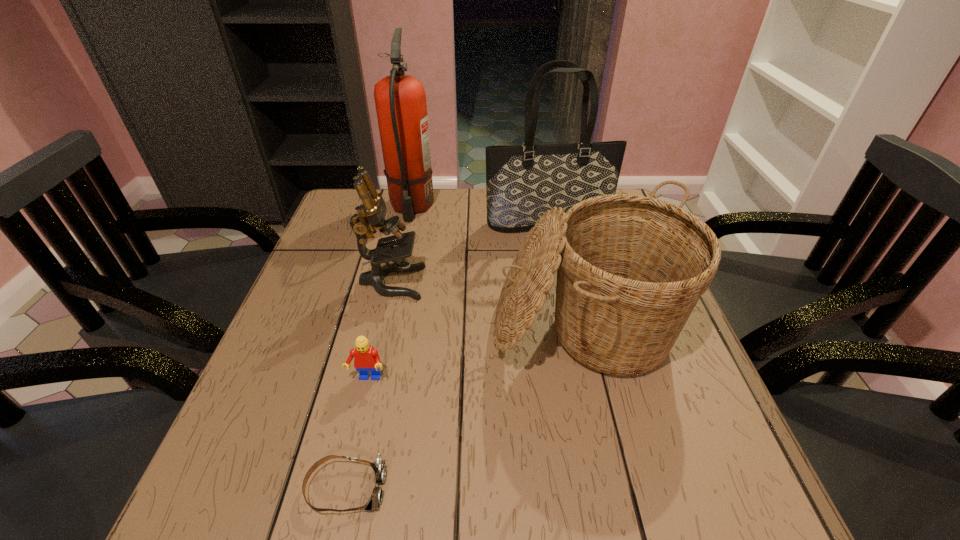
Where is `vacant space in between the fifth tallest object and the basket`? vacant space in between the fifth tallest object and the basket is located at coordinates (476, 356).

Where is `empty location between the shortest object and the microscope`? The height and width of the screenshot is (540, 960). empty location between the shortest object and the microscope is located at coordinates (369, 385).

Locate which object ranks second in proximity to the tote bag. Please provide its 2D coordinates. Your answer should be formatted as a tuple, i.e. [(x, y)], where the tuple contains the x and y coordinates of a point satisfying the conditions above.

[(630, 269)]

The image size is (960, 540). In order to click on the second closest object to the fifth tallest object in this screenshot , I will do `click(371, 214)`.

Find the location of a particular element. free location that satisfies the following two spatial constraints: 1. at the eyepieces of the microscope; 2. on the left side of the basket is located at coordinates (380, 334).

Locate an element on the screen. The image size is (960, 540). free space that satisfies the following two spatial constraints: 1. on the nozzle of the tote bag; 2. on the left side of the fire extinguisher is located at coordinates (408, 223).

Locate an element on the screen. This screenshot has width=960, height=540. free space that satisfies the following two spatial constraints: 1. at the eyepieces of the microscope; 2. on the front-facing side of the Lego is located at coordinates (370, 379).

Locate an element on the screen. This screenshot has height=540, width=960. vacant point that satisfies the following two spatial constraints: 1. on the front side of the tote bag; 2. at the eyepieces of the microscope is located at coordinates (560, 282).

Where is `vacant region that satisfies the following two spatial constraints: 1. at the eyepieces of the microscope; 2. on the left side of the basket`? The height and width of the screenshot is (540, 960). vacant region that satisfies the following two spatial constraints: 1. at the eyepieces of the microscope; 2. on the left side of the basket is located at coordinates (380, 334).

Locate an element on the screen. free region that satisfies the following two spatial constraints: 1. on the back side of the basket; 2. at the eyepieces of the microscope is located at coordinates (572, 282).